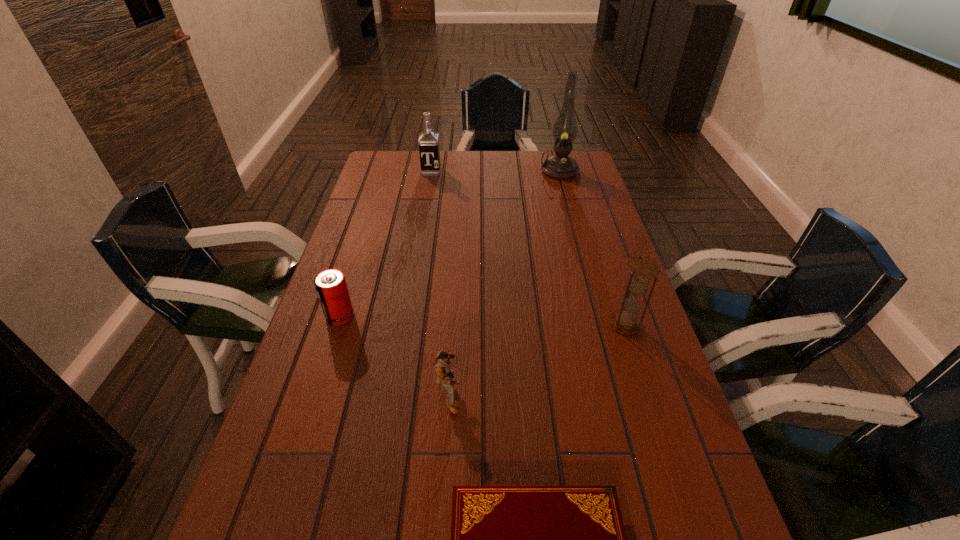
Image resolution: width=960 pixels, height=540 pixels. In order to click on oil lamp that is at the far edge in this screenshot , I will do `click(560, 166)`.

At what (x,y) coordinates should I click in order to perform the action: click on vodka that is at the far edge. Please return your answer as a coordinate pair (x, y). Looking at the image, I should click on (428, 141).

You are a GUI agent. You are given a task and a screenshot of the screen. Output one action in this format:
    pyautogui.click(x=<x>, y=<y>)
    Task: Click on the object present at the left edge
    The width and height of the screenshot is (960, 540).
    Given the screenshot: What is the action you would take?
    pyautogui.click(x=330, y=284)

This screenshot has width=960, height=540. What are the coordinates of `oil lamp that is at the right edge` in the screenshot? It's located at (560, 166).

Locate an element on the screen. The height and width of the screenshot is (540, 960). hourglass present at the right edge is located at coordinates (642, 268).

This screenshot has width=960, height=540. In order to click on object positioned at the far right corner in this screenshot , I will do `click(560, 166)`.

At what (x,y) coordinates should I click in order to perform the action: click on free space at the far edge of the desktop. Please return your answer as a coordinate pair (x, y). The width and height of the screenshot is (960, 540). Looking at the image, I should click on (480, 151).

The height and width of the screenshot is (540, 960). In order to click on free space at the left edge in this screenshot , I will do `click(330, 400)`.

Locate an element on the screen. free region at the right edge of the desktop is located at coordinates (603, 235).

Image resolution: width=960 pixels, height=540 pixels. I want to click on vacant space at the far left corner, so click(414, 157).